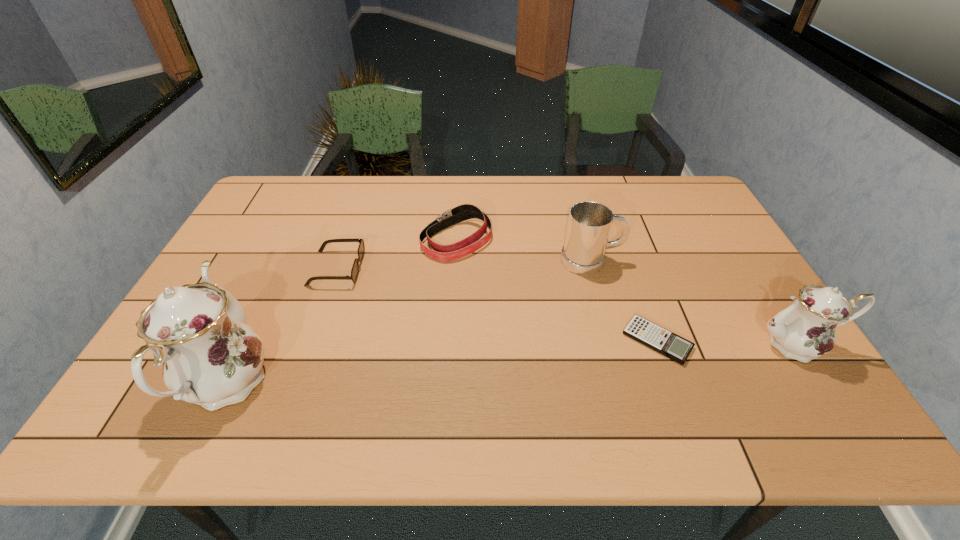
Identify the location of free space located 0.270m on the back of the right chinaware. point(739,255).

The width and height of the screenshot is (960, 540). I want to click on free space located 0.050m on the side of the mug with the handle, so click(638, 261).

Locate an element on the screen. Image resolution: width=960 pixels, height=540 pixels. vacant region located on the back of the third shortest object is located at coordinates (460, 185).

Locate an element on the screen. free location located 0.290m on the front-facing side of the second shortest object is located at coordinates (462, 268).

Locate an element on the screen. This screenshot has width=960, height=540. free space located on the left of the shortest object is located at coordinates (560, 341).

Locate an element on the screen. The height and width of the screenshot is (540, 960). calculator at the near edge is located at coordinates (657, 338).

The width and height of the screenshot is (960, 540). Find the location of `object that is at the left edge`. object that is at the left edge is located at coordinates [211, 357].

The height and width of the screenshot is (540, 960). In order to click on object present at the right edge in this screenshot , I will do [x=805, y=330].

The image size is (960, 540). In order to click on object that is positioned at the near left corner in this screenshot , I will do `click(211, 357)`.

This screenshot has height=540, width=960. Find the location of `object located in the near right corner section of the desktop`. object located in the near right corner section of the desktop is located at coordinates (805, 330).